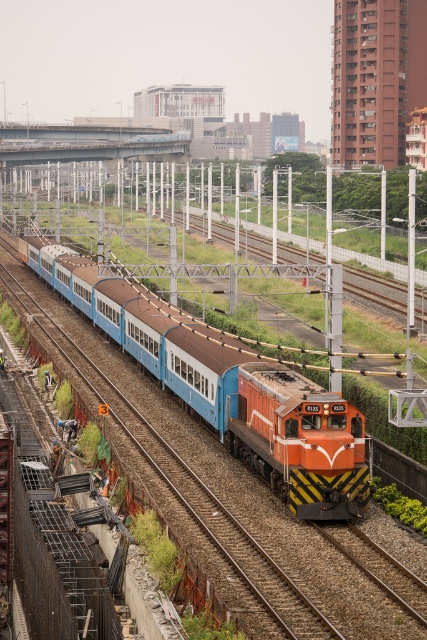
You are standing at a safe distance from the train tracks. There is a specific point marked at coordinates point (x=245, y=376) that you need to reach. Given that the distance from you to this point is 30.79 meters, can you walk directly to it without crossing the tracks?

The distance between you and the point (x=245, y=376) is 30.79 meters. Since you are already at a safe distance from the train tracks, you can walk directly to the point without crossing the tracks as long as the path is clear and accessible.

You are a railway engineer inspecting the train composition. You notice two locomotives labeled as orange glossy locomotive at center and orange metallic locomotive at center. Which one is bigger in size?

The orange glossy locomotive at center has a larger size compared to the orange metallic locomotive at center, so the orange glossy locomotive at center is bigger.